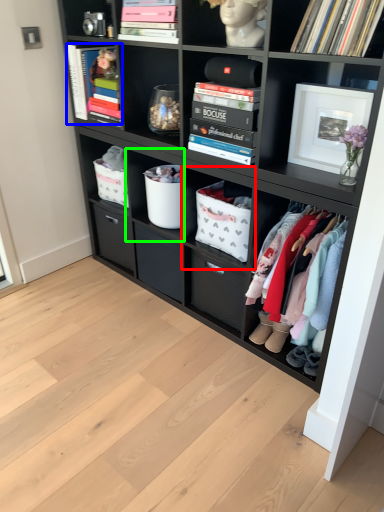
Question: Considering the real-world distances, which object is closest to shelf (highlighted by a red box)? magazine (highlighted by a blue box) or shelf (highlighted by a green box).

Choices:
 (A) magazine
 (B) shelf

Answer: (B)